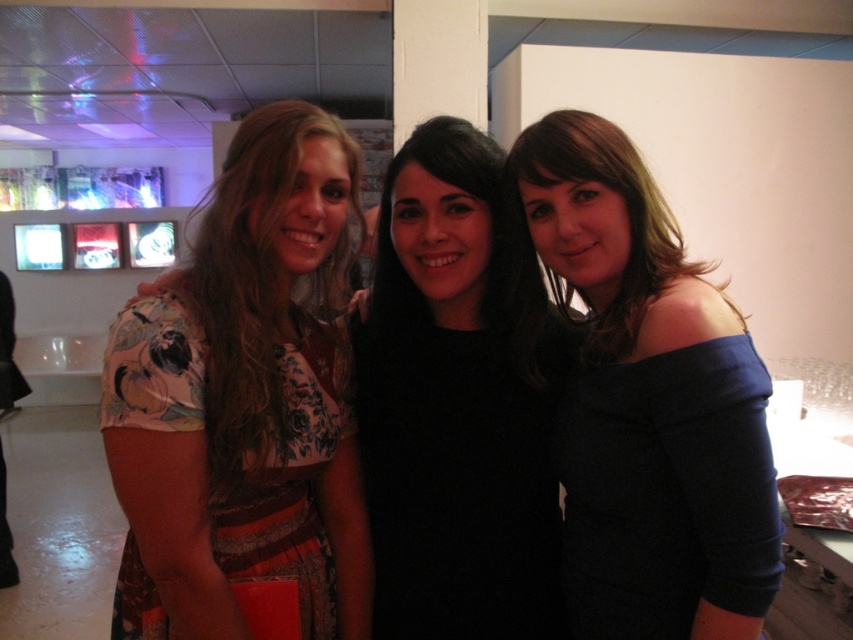
Does blue matte dress at center appear on the right side of black matte dress at center?

Indeed, blue matte dress at center is positioned on the right side of black matte dress at center.

Based on the photo, does blue matte dress at center appear over black matte dress at center?

Indeed, blue matte dress at center is positioned over black matte dress at center.

Does point (654, 552) come behind point (440, 356)?

No, (654, 552) is closer to viewer.

The height and width of the screenshot is (640, 853). Find the location of `blue matte dress at center`. blue matte dress at center is located at coordinates (648, 403).

This screenshot has height=640, width=853. Describe the element at coordinates (459, 477) in the screenshot. I see `black matte dress at center` at that location.

Who is more distant from viewer, (424, 577) or (619, 467)?

The point (424, 577) is behind.

Is point (554, 401) farther from camera compared to point (569, 548)?

Yes, it is behind point (569, 548).

What are the coordinates of `black matte dress at center` in the screenshot? It's located at (459, 477).

Is blue matte dress at center further to the viewer compared to floral-patterned fabric dress at left?

No, blue matte dress at center is in front of floral-patterned fabric dress at left.

Between blue matte dress at center and floral-patterned fabric dress at left, which one has more height?

With more height is blue matte dress at center.

Does point (721, 305) come closer to viewer compared to point (258, 528)?

Yes, point (721, 305) is closer to viewer.

At what (x,y) coordinates should I click in order to perform the action: click on blue matte dress at center. Please return your answer as a coordinate pair (x, y). This screenshot has width=853, height=640. Looking at the image, I should click on (648, 403).